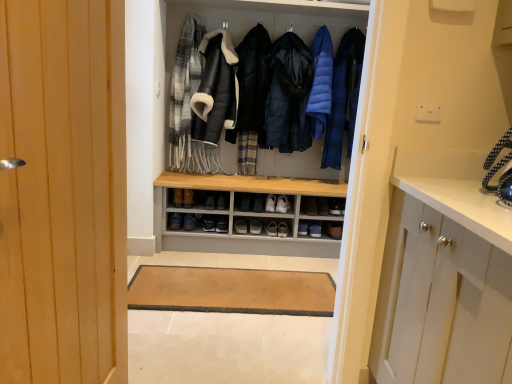
Question: In terms of width, does black quilted jacket at center, the 1th jacket positioned from the left, look wider or thinner when compared to leather jacket at center, which is the 1th garment in left-to-right order?

Choices:
 (A) wide
 (B) thin

Answer: (B)

Question: In the image, is black quilted jacket at center, the 2th jacket positioned from the right, positioned in front of or behind leather jacket at center, which is the 1th garment in left-to-right order?

Choices:
 (A) behind
 (B) front

Answer: (A)

Question: Which of these objects is positioned closest to the black leather shoe at center, the sixth footwear viewed from the left?

Choices:
 (A) brown leather shoe at center, positioned as the second shoe in left-to-right order
 (B) matte black shoe at center, arranged as the fourth footwear when viewed from the left
 (C) wooden door at left
 (D) dark blue puffer jacket at center, which is the first jacket in right-to-left order
 (E) blue down jacket at center

Answer: (B)

Question: Considering the real-world distances, which object is closest to the black leather shoe at center, arranged as the fourth footwear when viewed from the right?

Choices:
 (A) dark blue puffer jacket at center, which ranks as the second jacket in left-to-right order
 (B) leather jacket at center, which is the 1th garment in left-to-right order
 (C) wooden shelf at center
 (D) black leather shoe at center, the third shoe in the left-to-right sequence
 (E) black leather shoe at center, which appears as the 1th shoe when viewed from the right

Answer: (D)